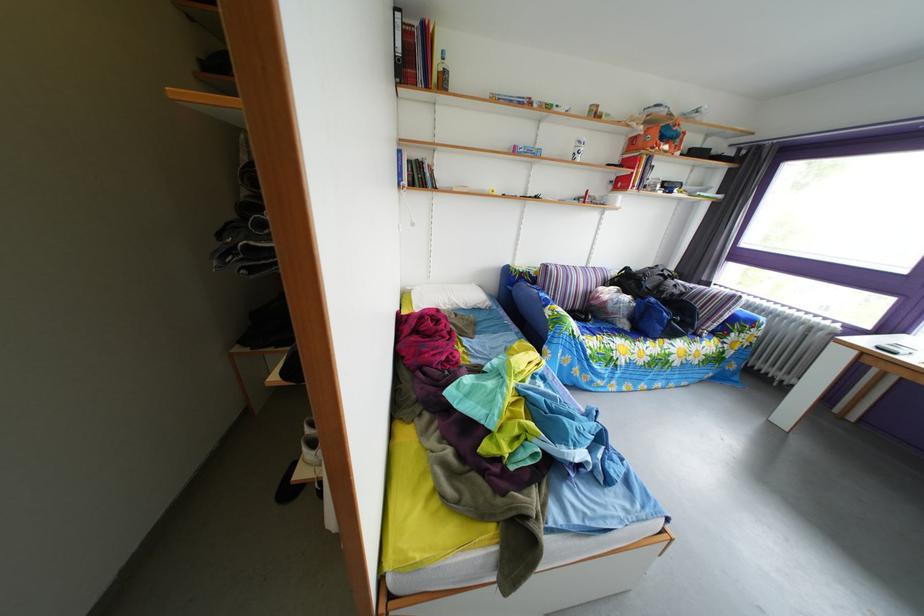
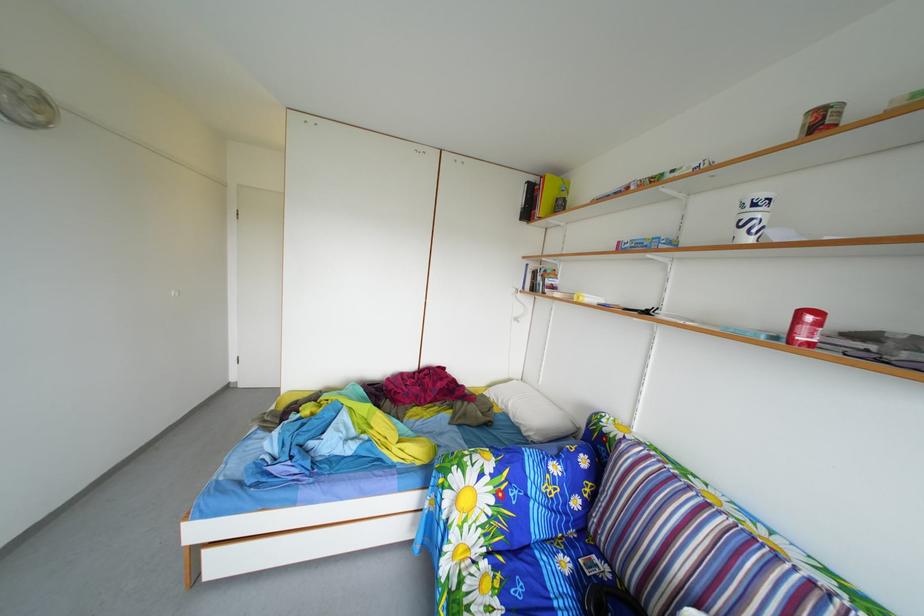
The point at [585,345] is marked in the first image. Where is the corresponding point in the second image?

(453, 507)